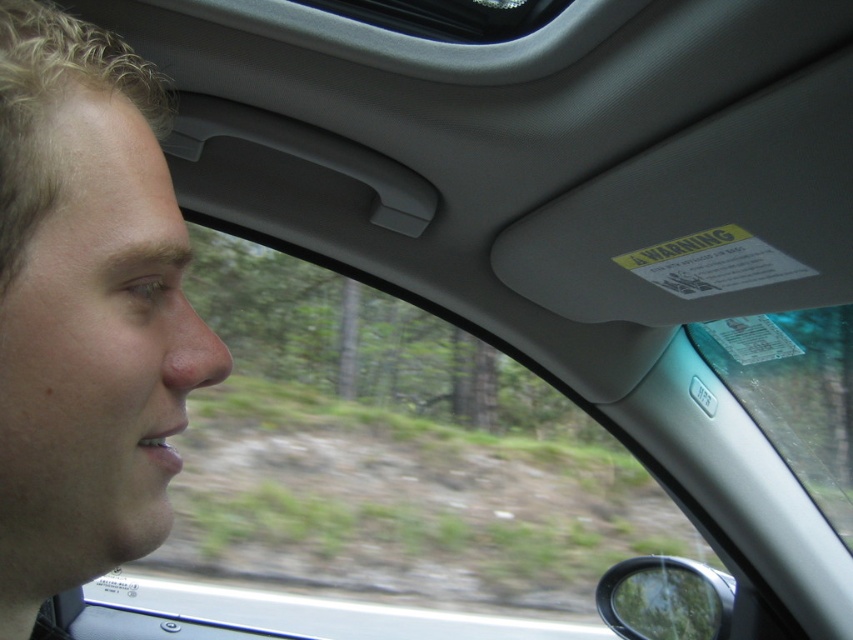
Can you confirm if pale skin face at left is positioned below transparent plastic sign at upper center?

Incorrect, pale skin face at left is not positioned below transparent plastic sign at upper center.

Is pale skin face at left taller than transparent plastic sign at upper center?

No, pale skin face at left is not taller than transparent plastic sign at upper center.

Who is more forward, (3, 620) or (833, 436)?

Positioned in front is point (3, 620).

Image resolution: width=853 pixels, height=640 pixels. I want to click on pale skin face at left, so click(85, 310).